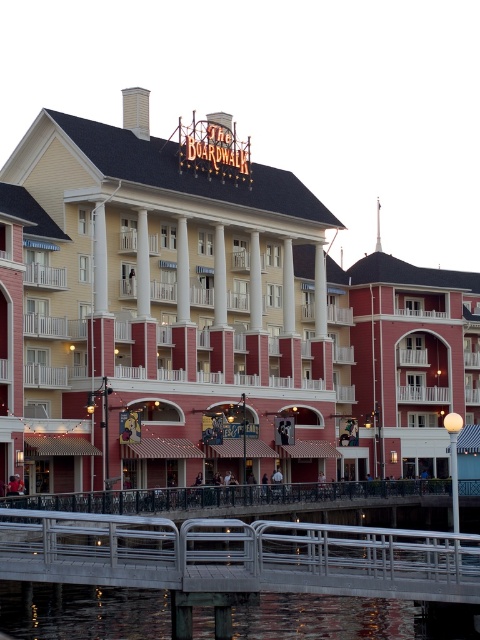
Based on the photo, you are standing at the entrance of The Boardwalk building and want to reach the silver metallic railing at lower center. According to the coordinates provided, what are the exact coordinates where you should head to locate it?

The silver metallic railing at lower center is located at coordinates point (238, 556).

You are a tourist standing at the waterfront and see the yellow siding building at center and the silver metallic railing at lower center. Which object is located to the left of the other?

The yellow siding building at center is positioned on the left side of silver metallic railing at lower center.